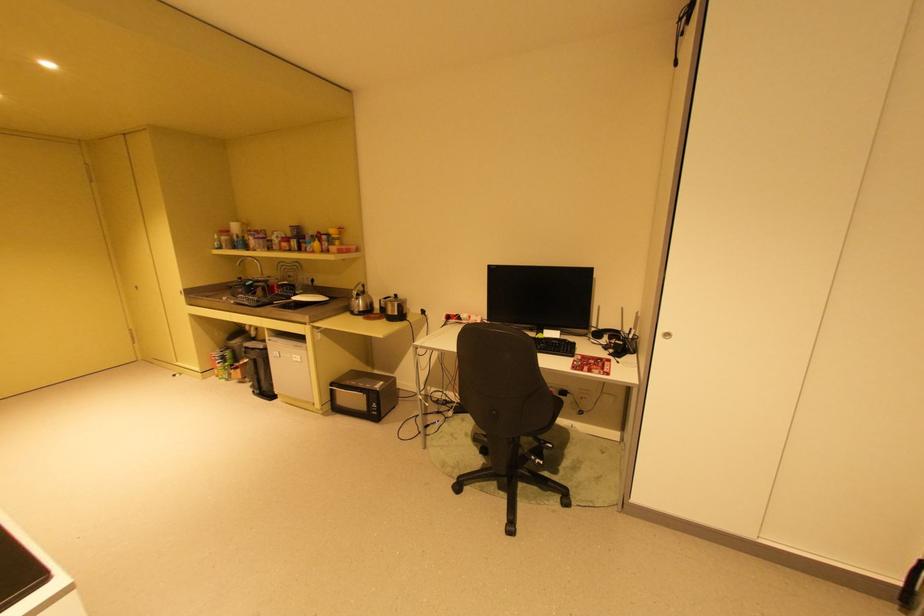
This screenshot has width=924, height=616. Find the location of `faucet handle`. faucet handle is located at coordinates pyautogui.click(x=250, y=264).